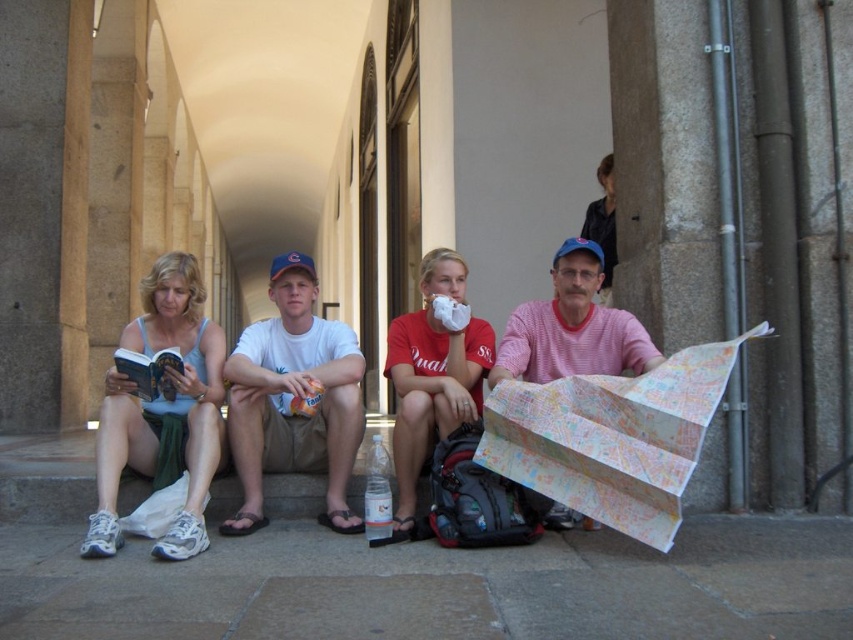
Who is taller, matte blue tank top at left or matte red t-shirt at center?

With more height is matte blue tank top at left.

Is point (91, 547) closer to viewer compared to point (413, 348)?

Yes, it is.

This screenshot has width=853, height=640. I want to click on matte blue tank top at left, so [x=163, y=412].

Who is shorter, white cotton t-shirt at center or pink striped shirt at center?

pink striped shirt at center

Is point (316, 364) farther from viewer compared to point (561, 353)?

Yes.

Which is in front, point (251, 396) or point (556, 294)?

Positioned in front is point (251, 396).

You are a GUI agent. You are given a task and a screenshot of the screen. Output one action in this format:
    pyautogui.click(x=<x>, y=<y>)
    Task: Click on the white cotton t-shirt at center
    The height and width of the screenshot is (640, 853).
    Given the screenshot: What is the action you would take?
    pyautogui.click(x=294, y=397)

Can you confirm if white cotton t-shirt at center is positioned to the right of matte red t-shirt at center?

In fact, white cotton t-shirt at center is to the left of matte red t-shirt at center.

Is the position of white cotton t-shirt at center more distant than that of matte red t-shirt at center?

Yes, white cotton t-shirt at center is further from the viewer.

Between point (241, 429) and point (468, 339), which one is positioned behind?

Positioned behind is point (468, 339).

The width and height of the screenshot is (853, 640). Find the location of `white cotton t-shirt at center`. white cotton t-shirt at center is located at coordinates (294, 397).